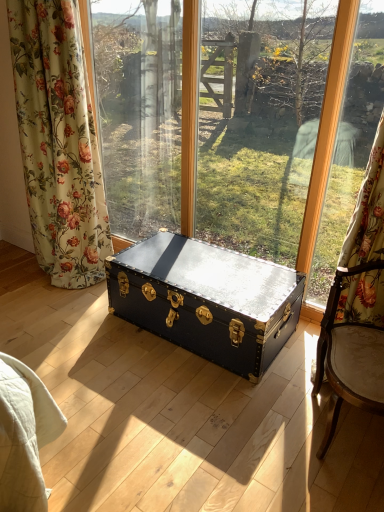
Identify the location of vacant area on top of shiny black trunk at center (from a real-world perspective). (207, 268).